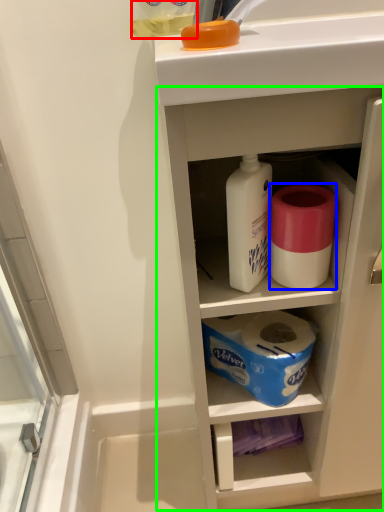
Question: Which is nearer to the bottle (highlighted by a red box)? toilet paper (highlighted by a blue box) or cabinetry (highlighted by a green box).

Choices:
 (A) toilet paper
 (B) cabinetry

Answer: (A)